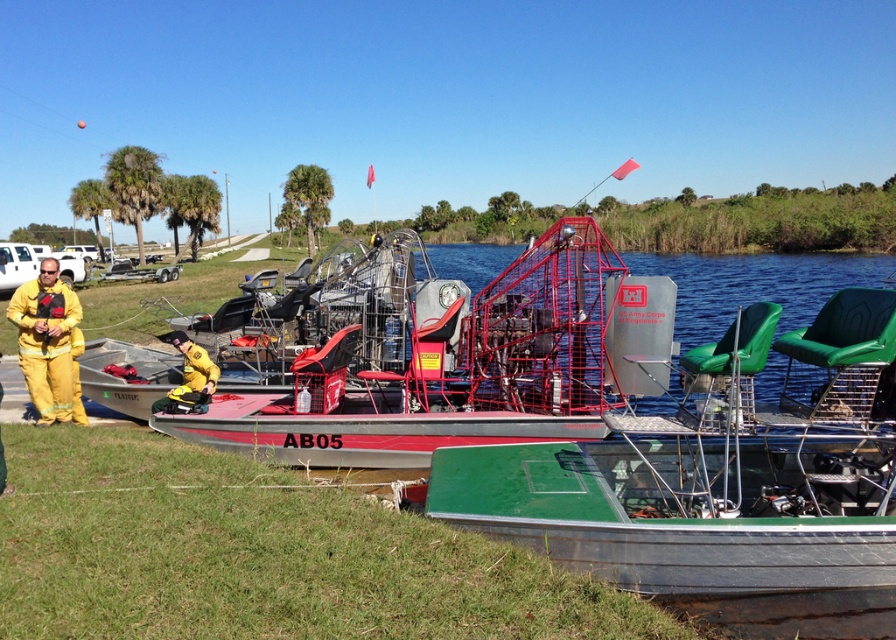
Question: Can you confirm if yellow fireproof suit at left is positioned below yellow fabric firefighter at lower left?

Choices:
 (A) yes
 (B) no

Answer: (B)

Question: Is red matte airboat at center to the right of red metal airboat at center from the viewer's perspective?

Choices:
 (A) yes
 (B) no

Answer: (B)

Question: Estimate the real-world distances between objects in this image. Which object is closer to the green metallic boat at lower right?

Choices:
 (A) yellow fireproof suit at left
 (B) red matte airboat at center
 (C) green grass at lower left

Answer: (C)

Question: Which is farther from the green metallic boat at lower right?

Choices:
 (A) yellow fireproof suit at left
 (B) red matte airboat at center

Answer: (A)

Question: Which of the following is the farthest from the observer?

Choices:
 (A) green grass at lower left
 (B) red matte airboat at center
 (C) green metallic boat at lower right

Answer: (B)

Question: In this image, where is green grass at lower left located relative to yellow fireproof suit at left?

Choices:
 (A) left
 (B) right

Answer: (B)